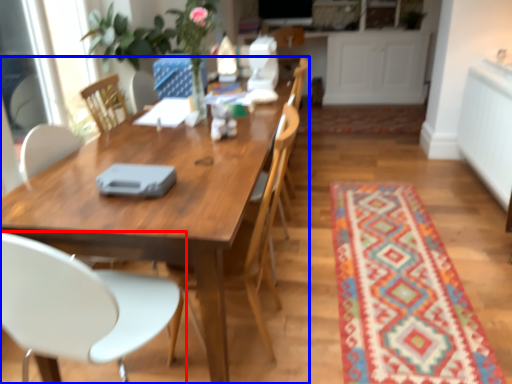
Question: Which of the following is the farthest to the observer, chair (highlighted by a red box) or kitchen & dining room table (highlighted by a blue box)?

Choices:
 (A) chair
 (B) kitchen & dining room table

Answer: (B)